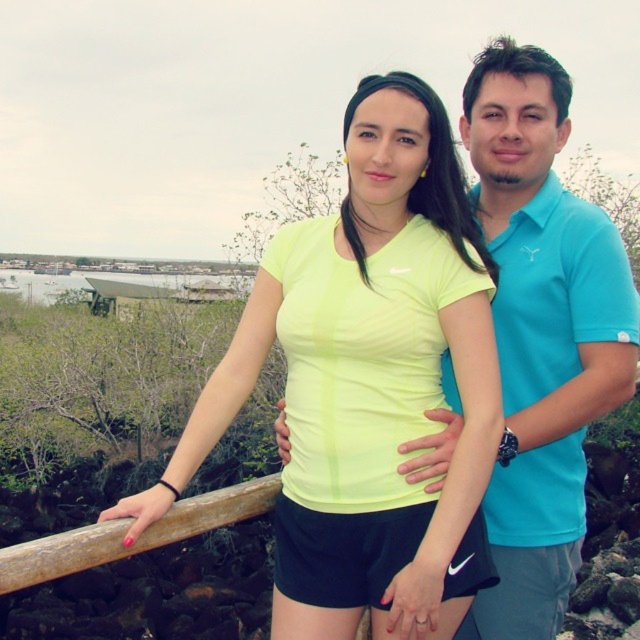
You are a photographer trying to adjust the lighting for a photo shoot. You notice two main colors in the image at the center area. The neon yellow fabric at center and the matte blue polo shirt at center. Which color is positioned more to the left in the central area?

The neon yellow fabric at center is positioned more to the left in the central area compared to the matte blue polo shirt at center.

You are a photographer trying to adjust the focus of your camera. You have two points in the image you need to focus on, point 1 at coordinates point (388,436) and point 2 at coordinates point (19,579). Which point should you focus on first to ensure the subject closest to the camera is sharp?

Point 1 at coordinates point (388,436) is closer to the viewer than point 2 at coordinates point (19,579), so you should focus on point 1 first to ensure the subject closest to the camera is sharp.

You are a photographer setting up for a group photo. You notice the neon yellow fabric at center and the wooden at left in the scene. Which object should you adjust your focus on first if you want to ensure both are in sharp focus?

You should focus on the wooden at left first because it is closer to you than the neon yellow fabric at center, which is further away. This way, adjusting focus starting from the closer object ensures both are in sharp focus.